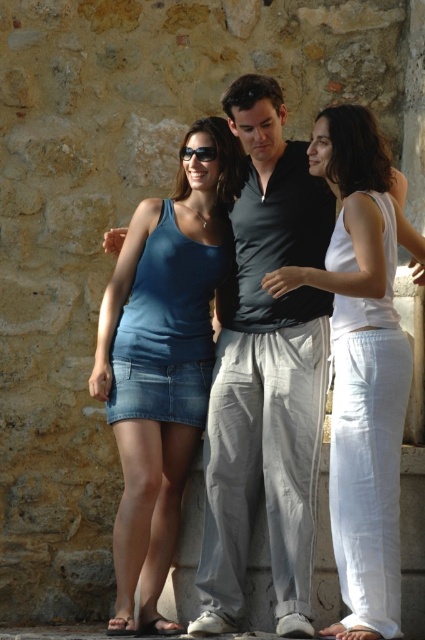
You are a photographer trying to capture a candid shot of the blue denim skirt at center and the black plastic sunglasses at center. Given that your camera has a minimum focus distance of 15 feet, will you be able to focus on both objects simultaneously?

The distance between the blue denim skirt at center and the black plastic sunglasses at center is 14.52 feet, which is less than the camera minimum focus distance of 15 feet. Therefore, the camera can focus on both objects simultaneously.

You are a photographer trying to capture a candid shot of the denim skirt at center and the black plastic sunglasses at center. Since you want to ensure both are visible in the frame, which object should you position closer to the left side of your camera viewfinder to include both?

You should position the denim skirt at center closer to the left side of your camera viewfinder because it is already to the left of the black plastic sunglasses at center, ensuring both are visible in the frame.

You are a fashion designer analyzing the clothing items in the scene. You need to determine which item is taller between the white cotton tank top at center and the black plastic sunglasses at center. Which one is taller?

The white cotton tank top at center has a greater height compared to the black plastic sunglasses at center, so the white cotton tank top at center is taller.